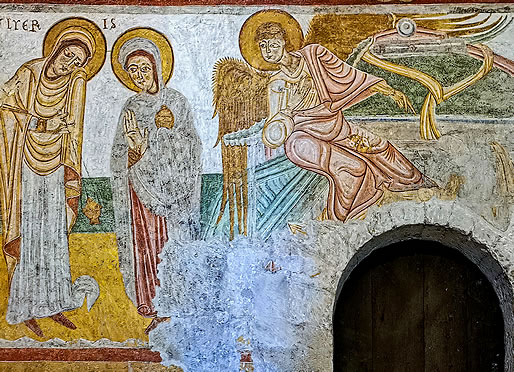
Locate an element on the screen. The height and width of the screenshot is (372, 514). door way is located at coordinates (413, 294).